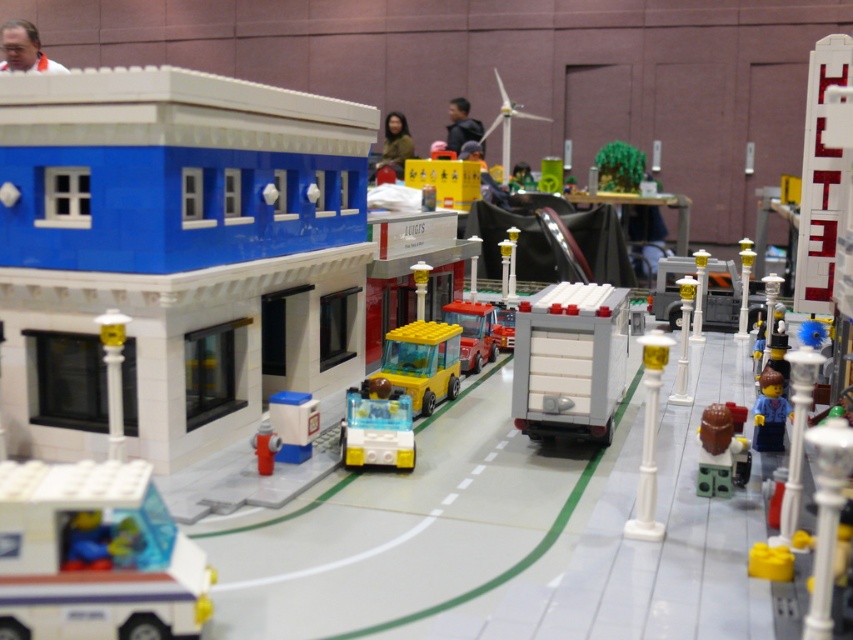
Question: Does yellow matte car at center appear on the left side of matte orange shirt at upper left?

Choices:
 (A) no
 (B) yes

Answer: (A)

Question: Is white plastic mail truck at lower left above translucent blue plastic car at center?

Choices:
 (A) no
 (B) yes

Answer: (A)

Question: Which object is the farthest from the translucent blue plastic car at center?

Choices:
 (A) yellow matte truck at center
 (B) white plastic truck at center

Answer: (A)

Question: Does yellow matte truck at center appear over matte orange shirt at upper left?

Choices:
 (A) yes
 (B) no

Answer: (B)

Question: Which point is farther to the camera?

Choices:
 (A) translucent blue plastic car at center
 (B) yellow matte car at center
 (C) matte brown hair at center
 (D) translucent blue plastic at center

Answer: (C)

Question: Estimate the real-world distances between objects in this image. Which object is closer to the brown matte minifigure at center-right?

Choices:
 (A) translucent blue plastic car at center
 (B) matte orange shirt at upper left
 (C) yellow matte truck at center
 (D) white plastic mail truck at lower left

Answer: (A)